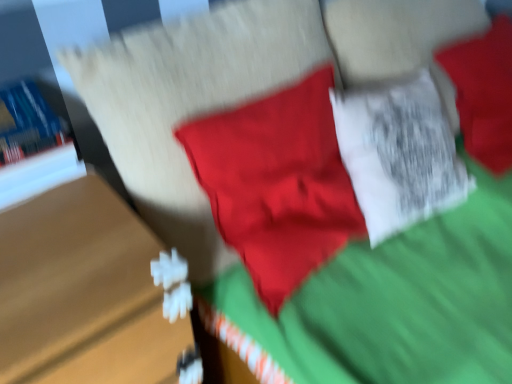
Locate an element on the screen. free location to the right of blue hardcover book at left is located at coordinates (83, 199).